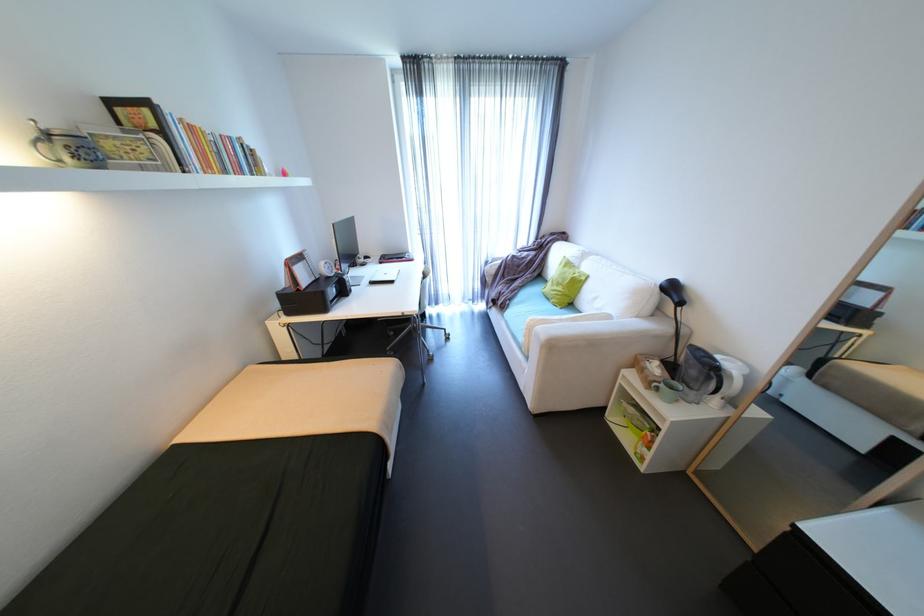
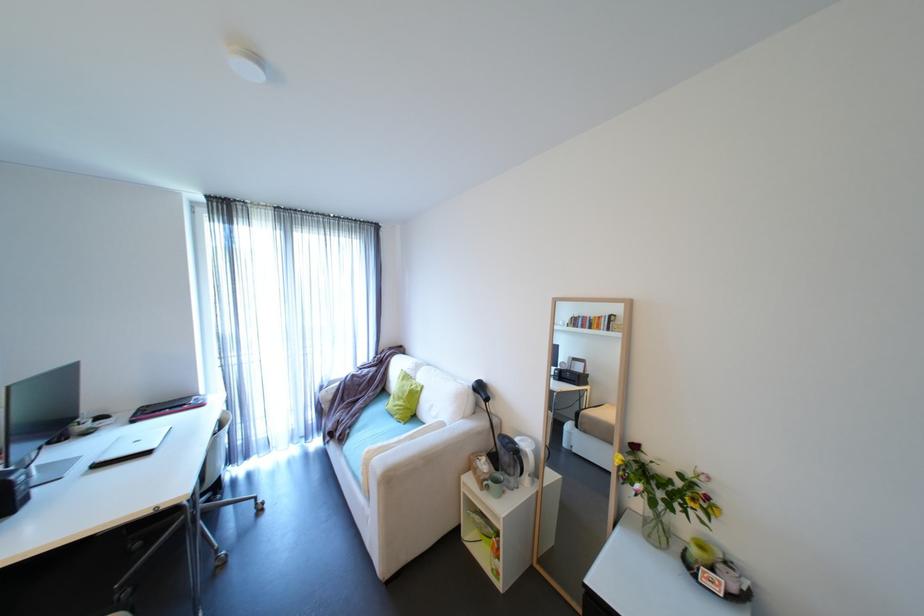
Locate, in the second image, the point that corresponds to [664,375] in the first image.

(492, 471)